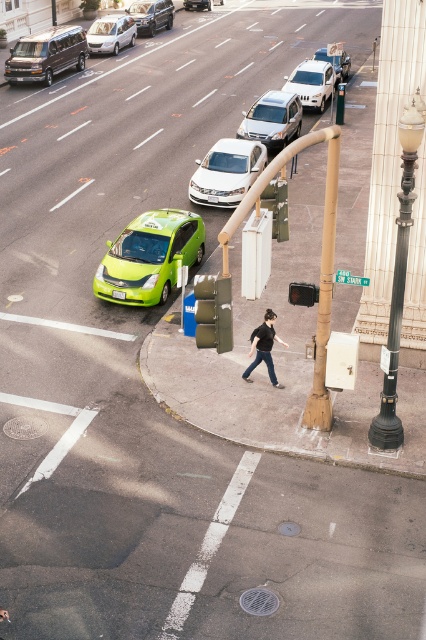
Question: Can you confirm if green matte taxi at center is positioned to the right of black plastic traffic light at center?

Choices:
 (A) yes
 (B) no

Answer: (B)

Question: Is satin silver sedan at upper center to the right of matte silver minivan at upper left from the viewer's perspective?

Choices:
 (A) no
 (B) yes

Answer: (B)

Question: Which of these objects is positioned farthest from the white matte suv at center?

Choices:
 (A) black cotton shirt at center
 (B) shiny silver sedan at center

Answer: (B)

Question: Estimate the real-world distances between objects in this image. Which object is farther from the satin silver sedan at center?

Choices:
 (A) green matte taxi at center
 (B) black cotton shirt at center
 (C) shiny silver sedan at upper center

Answer: (C)

Question: Does white matte suv at center come in front of metallic silver sedan at center?

Choices:
 (A) no
 (B) yes

Answer: (B)

Question: Which of the following is the closest to the observer?

Choices:
 (A) (310, 74)
 (B) (348, 68)

Answer: (A)